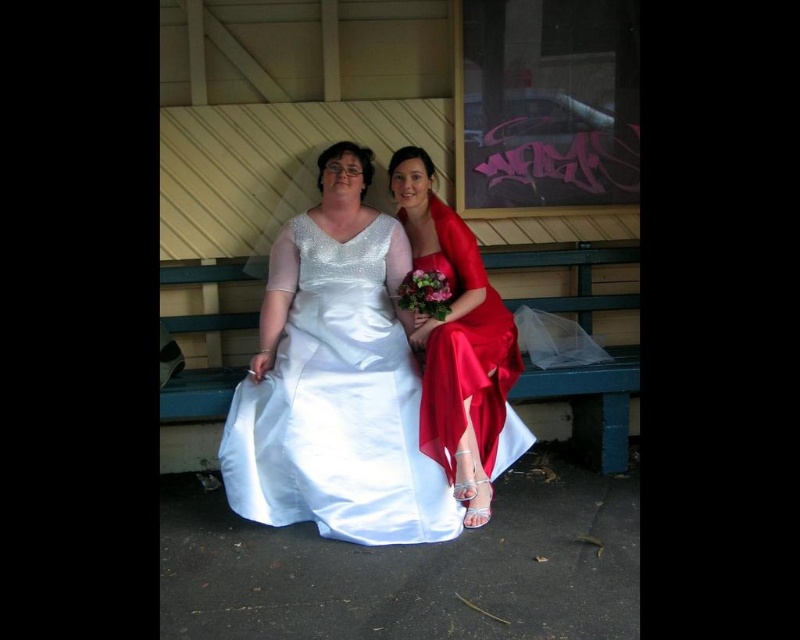
Who is shorter, satin white dress at center or green wooden bench at center?

green wooden bench at center is shorter.

Which is in front, point (426, 483) or point (598, 387)?

Point (426, 483) is in front.

I want to click on satin white dress at center, so click(337, 401).

Who is more forward, (260,440) or (420,241)?

Point (260,440) is in front.

Is satin white dress at center positioned at the back of satin dress at center?

Yes, it is.

What do you see at coordinates (337, 401) in the screenshot? I see `satin white dress at center` at bounding box center [337, 401].

Locate an element on the screen. The height and width of the screenshot is (640, 800). satin white dress at center is located at coordinates (337, 401).

Can you confirm if satin dress at center is smaller than green wooden bench at center?

No, satin dress at center is not smaller than green wooden bench at center.

Can you confirm if satin dress at center is positioned to the right of green wooden bench at center?

No, satin dress at center is not to the right of green wooden bench at center.

You are a GUI agent. You are given a task and a screenshot of the screen. Output one action in this format:
    pyautogui.click(x=<x>, y=<y>)
    Task: Click on the satin dress at center
    Image resolution: width=800 pixels, height=640 pixels.
    Given the screenshot: What is the action you would take?
    pyautogui.click(x=456, y=340)

Find the location of a particular element. Image resolution: width=800 pixels, height=640 pixels. satin dress at center is located at coordinates (456, 340).